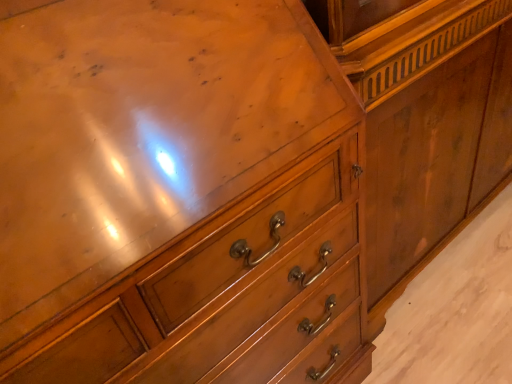
Locate an element on the screen. This screenshot has width=512, height=384. glossy wood drawer at center is located at coordinates (232, 295).

The height and width of the screenshot is (384, 512). What do you see at coordinates (232, 295) in the screenshot?
I see `glossy wood drawer at center` at bounding box center [232, 295].

Where is `glossy wood drawer at center`? glossy wood drawer at center is located at coordinates (232, 295).